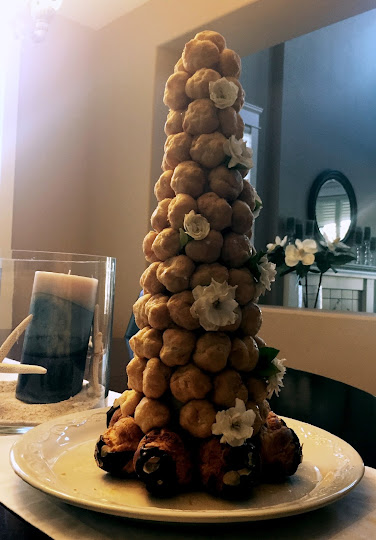
Image resolution: width=376 pixels, height=540 pixels. What are the coordinates of `wall` in the screenshot? It's located at (101, 122), (55, 154).